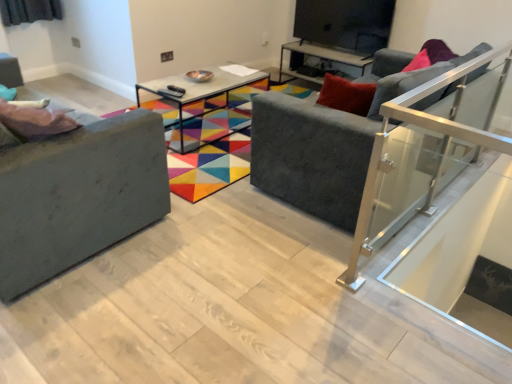
Question: Is matte gray couch at left, placed as the second studio couch when sorted from right to left, to the left or to the right of metallic glass table at center, placed as the second table when sorted from back to front, in the image?

Choices:
 (A) right
 (B) left

Answer: (B)

Question: Is matte gray couch at left, the 1th studio couch viewed from the left, in front of or behind metallic glass table at center, arranged as the first table when viewed from the front, in the image?

Choices:
 (A) front
 (B) behind

Answer: (A)

Question: Estimate the real-world distances between objects in this image. Which object is closer to the matte black tv stand at upper center?

Choices:
 (A) velvet grey couch at center, the 1th studio couch from the right
 (B) metallic glass table at center, the first table when ordered from back to front
 (C) pink fabric pillow at left
 (D) matte gray couch at left, the 1th studio couch viewed from the left
 (E) metallic glass table at center, placed as the second table when sorted from back to front

Answer: (B)

Question: Estimate the real-world distances between objects in this image. Which object is farther from the pink fabric pillow at left?

Choices:
 (A) matte gray couch at left, the 1th studio couch viewed from the left
 (B) metallic glass table at center, arranged as the first table when viewed from the front
 (C) velvet grey couch at center, the 2th studio couch in the left-to-right sequence
 (D) matte black tv stand at upper center
 (E) metallic glass table at center, placed as the first table when sorted from right to left

Answer: (D)